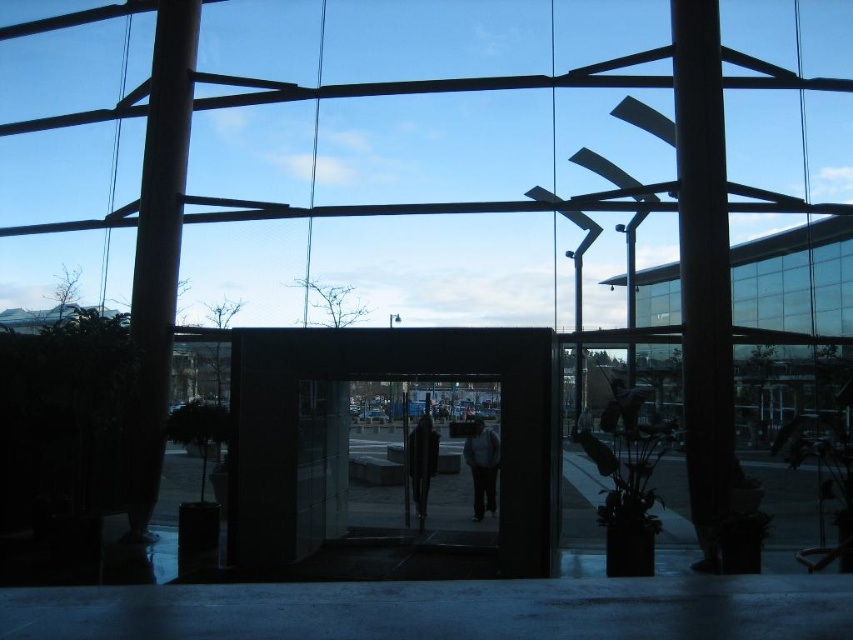
Question: Which of these objects is positioned closest to the matte glass pillar at left?

Choices:
 (A) smooth dark brown wooden pillar at right
 (B) dark gray coat at center

Answer: (B)

Question: Does smooth dark brown wooden pillar at right appear on the left side of dark gray coat at center?

Choices:
 (A) yes
 (B) no

Answer: (B)

Question: Is dark gray sweater at center to the left of dark gray coat at center from the viewer's perspective?

Choices:
 (A) yes
 (B) no

Answer: (B)

Question: Which object appears closest to the camera in this image?

Choices:
 (A) smooth dark brown wooden pillar at right
 (B) dark gray sweater at center

Answer: (A)

Question: Does smooth dark brown wooden pillar at right appear under dark gray coat at center?

Choices:
 (A) yes
 (B) no

Answer: (B)

Question: Which object is closer to the camera taking this photo?

Choices:
 (A) matte glass pillar at left
 (B) smooth dark brown wooden pillar at right
 (C) dark gray coat at center
 (D) transparent glass door at center

Answer: (D)